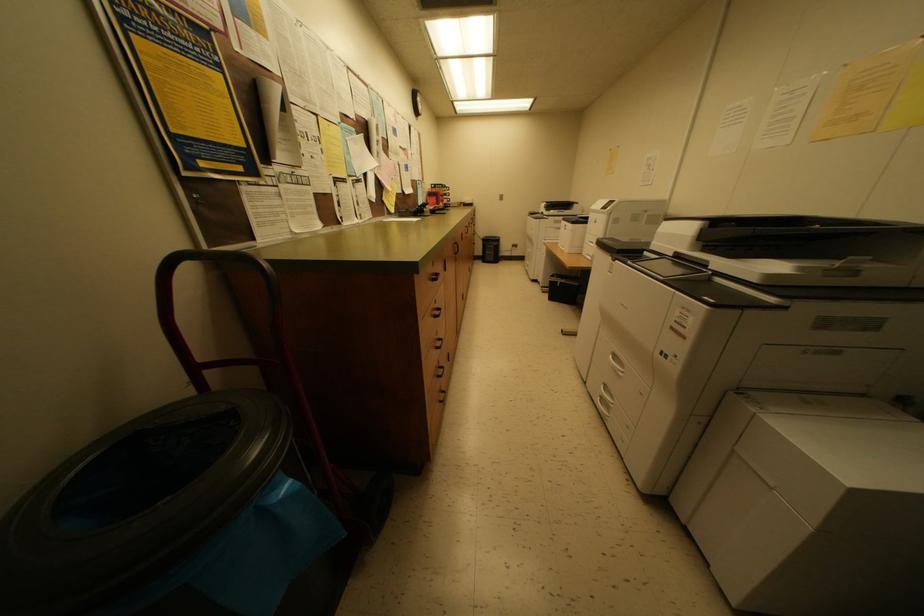
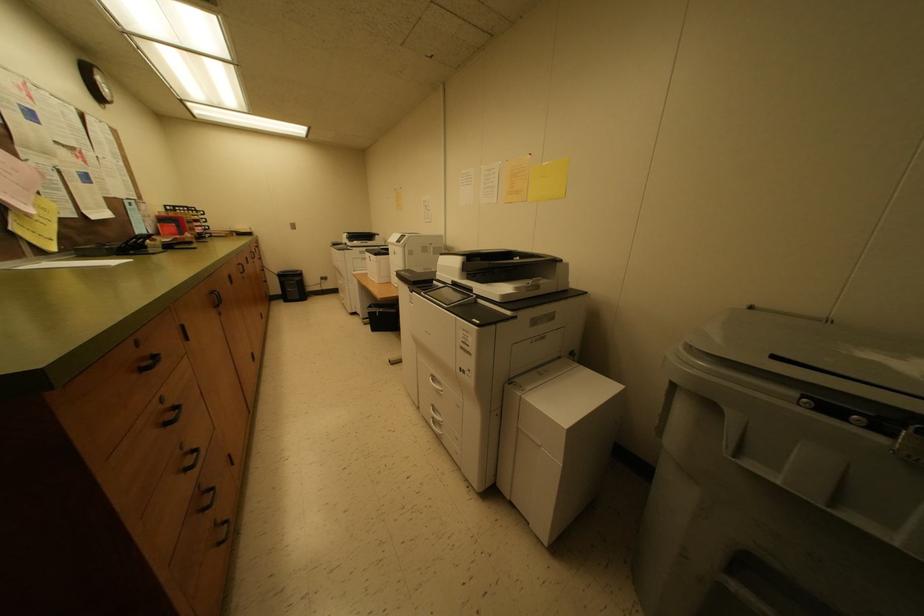
Question: The camera is either moving clockwise (left) or counter-clockwise (right) around the object. The first image is from the beginning of the video and the second image is from the end. Is the camera moving left or right when shooting the video?

Choices:
 (A) Left
 (B) Right

Answer: (A)